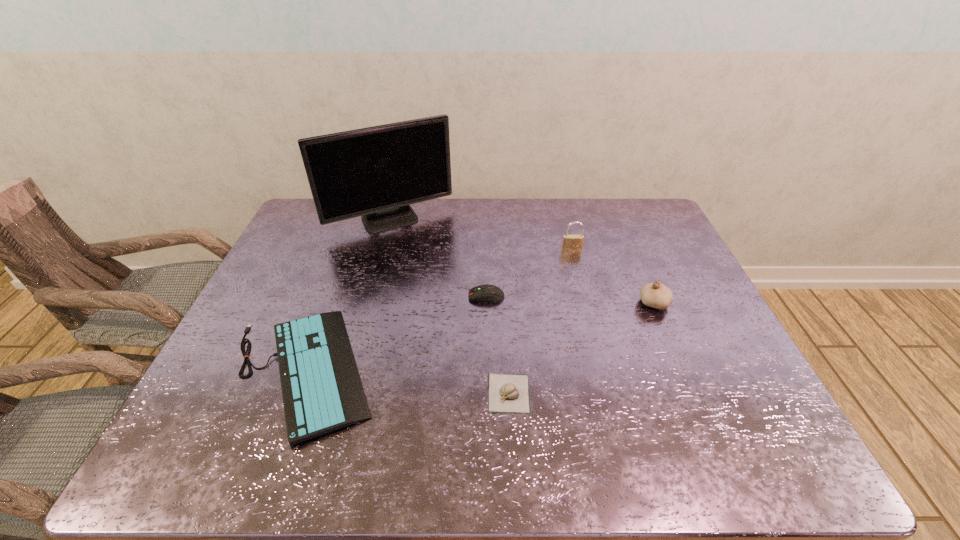
This screenshot has height=540, width=960. In order to click on computer monitor positioned at the left edge in this screenshot , I will do `click(376, 172)`.

The height and width of the screenshot is (540, 960). Identify the location of computer keyboard located at the left edge. (322, 391).

The height and width of the screenshot is (540, 960). What are the coordinates of `object positioned at the right edge` in the screenshot? It's located at (656, 295).

Identify the location of object located at the far left corner. Image resolution: width=960 pixels, height=540 pixels. (376, 172).

At what (x,y) coordinates should I click in order to perform the action: click on object situated at the near left corner. Please return your answer as a coordinate pair (x, y). This screenshot has width=960, height=540. Looking at the image, I should click on (322, 391).

Image resolution: width=960 pixels, height=540 pixels. I want to click on vacant space at the far edge, so click(x=562, y=226).

At what (x,y) coordinates should I click in order to perform the action: click on vacant space at the near edge. Please return your answer as a coordinate pair (x, y). This screenshot has height=540, width=960. Looking at the image, I should click on point(596,459).

Find the location of a particular element. The image size is (960, 540). vacant space at the left edge of the desktop is located at coordinates pyautogui.click(x=243, y=419).

Where is `free region at the right edge of the desktop`? free region at the right edge of the desktop is located at coordinates (708, 363).

At what (x,y) coordinates should I click in order to perform the action: click on vacant space at the near left corner of the desktop. Please return your answer as a coordinate pair (x, y). Image resolution: width=960 pixels, height=540 pixels. Looking at the image, I should click on (198, 465).